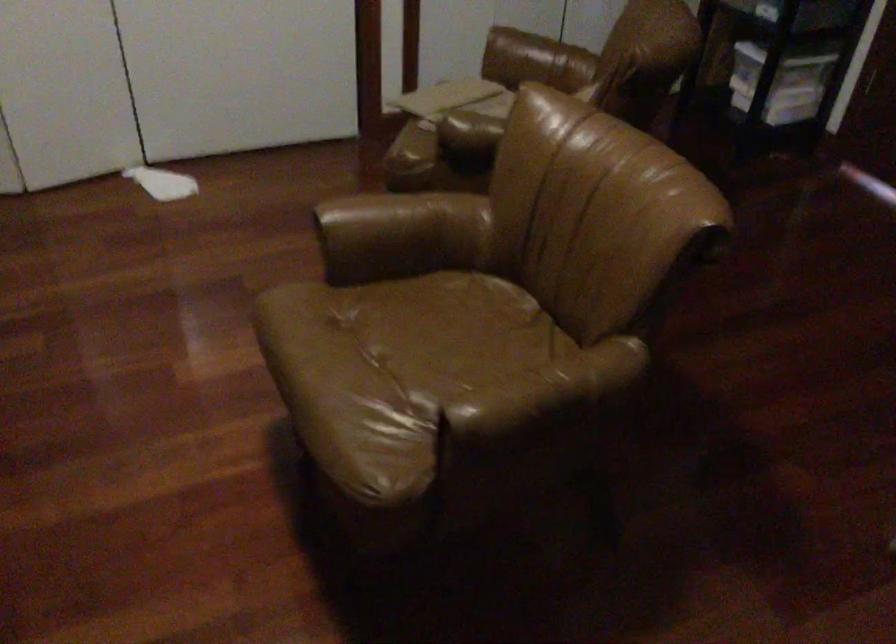
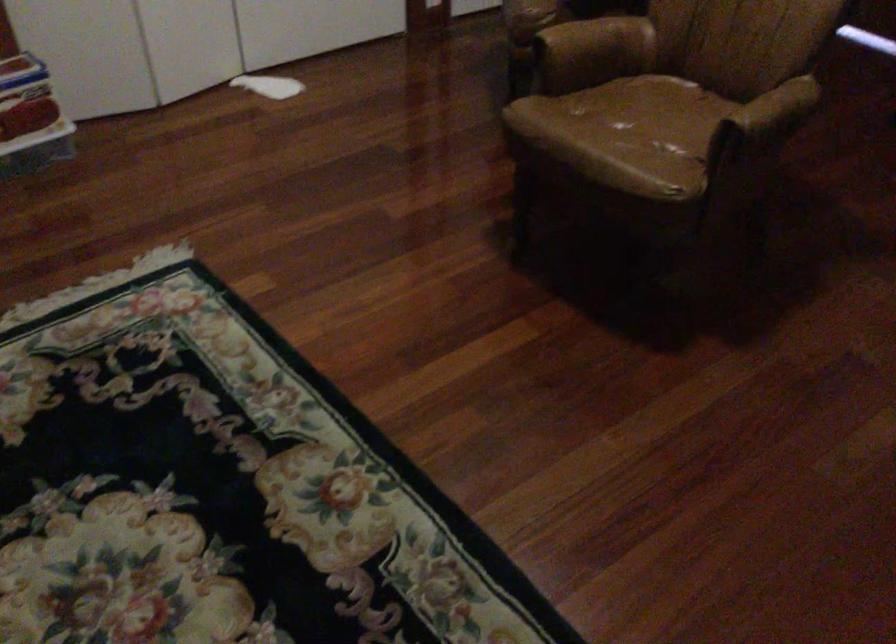
Find the pixel in the second image that matches (x=554, y=395) in the first image.

(776, 109)